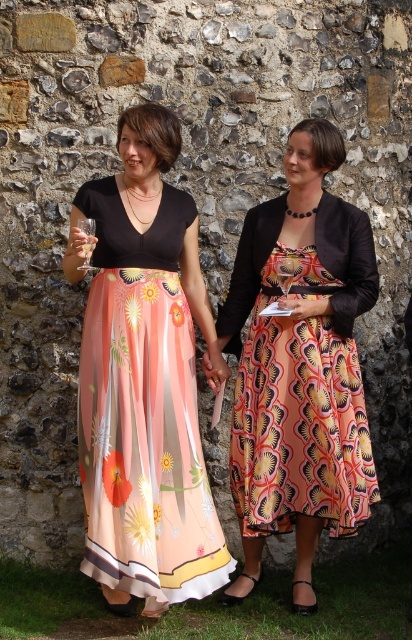
From the picture: Based on the scene description, where is the matte floral skirt at center located in terms of coordinates?

The matte floral skirt at center is located at point coordinates of (145, 378).

You are a photographer taking a portrait of the two women. You want to focus on the matte black dress at center without the clear glass wine glass at center appearing in the foreground. Is this possible based on their positions?

The matte black dress at center is closer to the viewer than the clear glass wine glass at center, so focusing on the matte black dress at center would place the clear glass wine glass at center in the background, making it possible to avoid the glass appearing in the foreground.